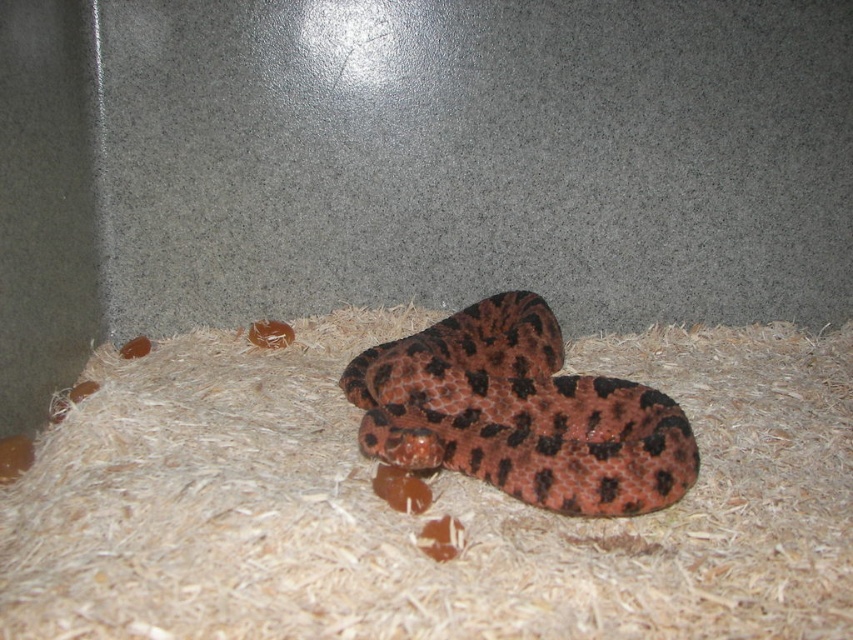
Can you confirm if brown shredded hay at center is thinner than leopard print snake at center?

Incorrect, brown shredded hay at center's width is not less than leopard print snake at center's.

What do you see at coordinates (432, 504) in the screenshot?
I see `brown shredded hay at center` at bounding box center [432, 504].

This screenshot has height=640, width=853. In order to click on brown shredded hay at center in this screenshot , I will do [432, 504].

The height and width of the screenshot is (640, 853). What are the coordinates of `brown shredded hay at center` in the screenshot? It's located at click(432, 504).